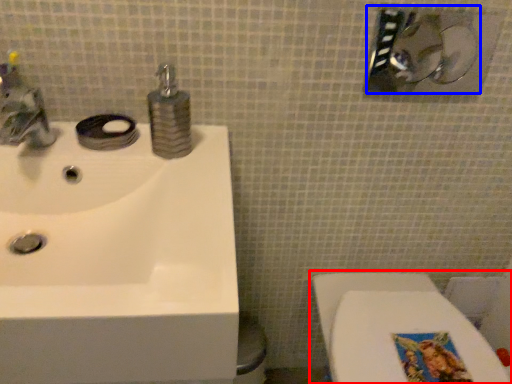
Question: Which of the following is the farthest to the observer, toilet (highlighted by a red box) or shower (highlighted by a blue box)?

Choices:
 (A) toilet
 (B) shower

Answer: (A)